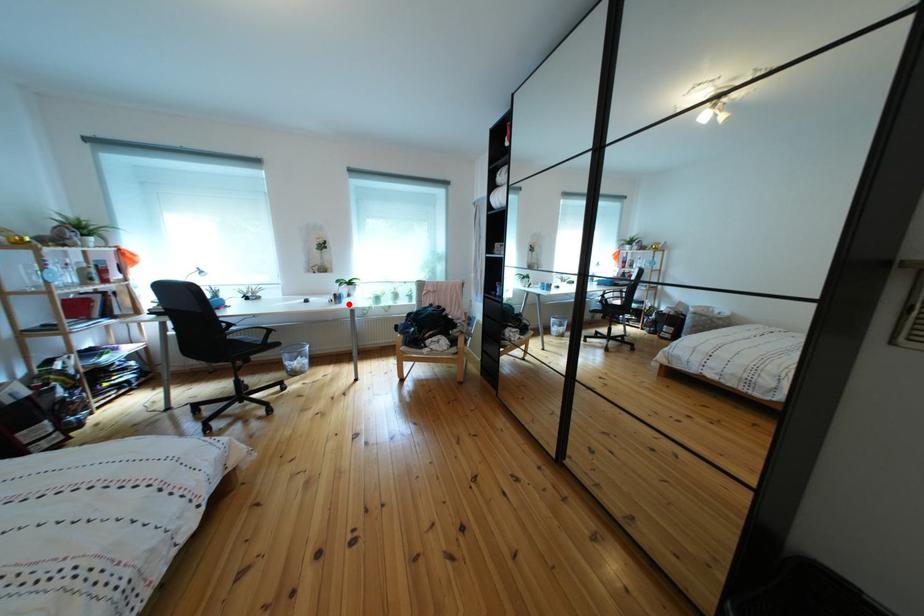
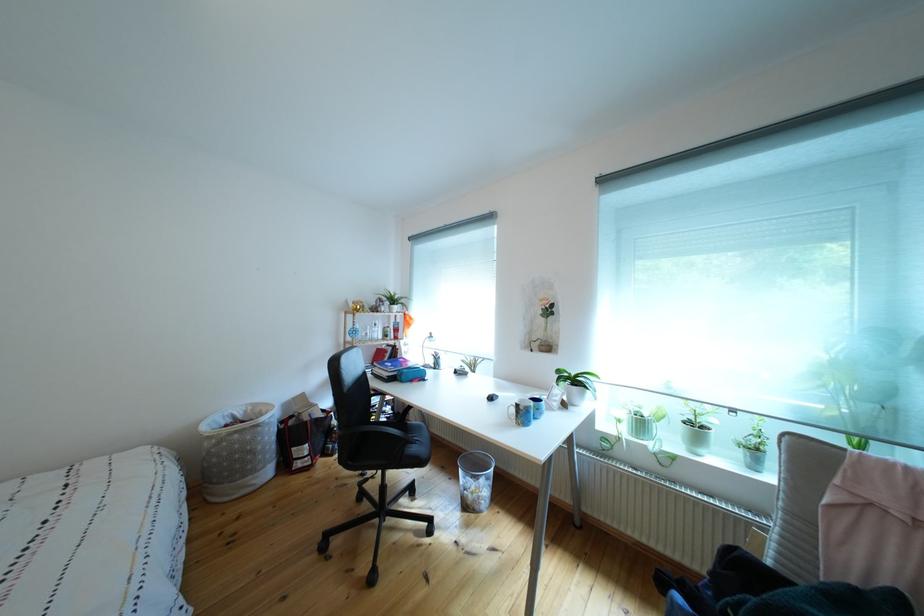
Question: I am providing you with two images of the same scene from different viewpoints. A red point is marked on the first image. At the location where the point appears in image 1, is it still visible in image 2?

Choices:
 (A) Yes
 (B) No

Answer: (A)